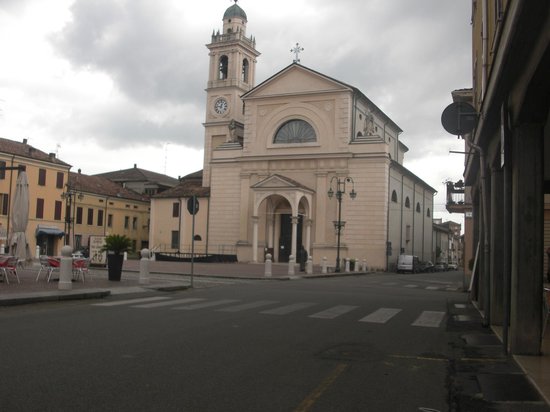
Image resolution: width=550 pixels, height=412 pixels. In order to click on plant in this screenshot , I will do `click(113, 250)`.